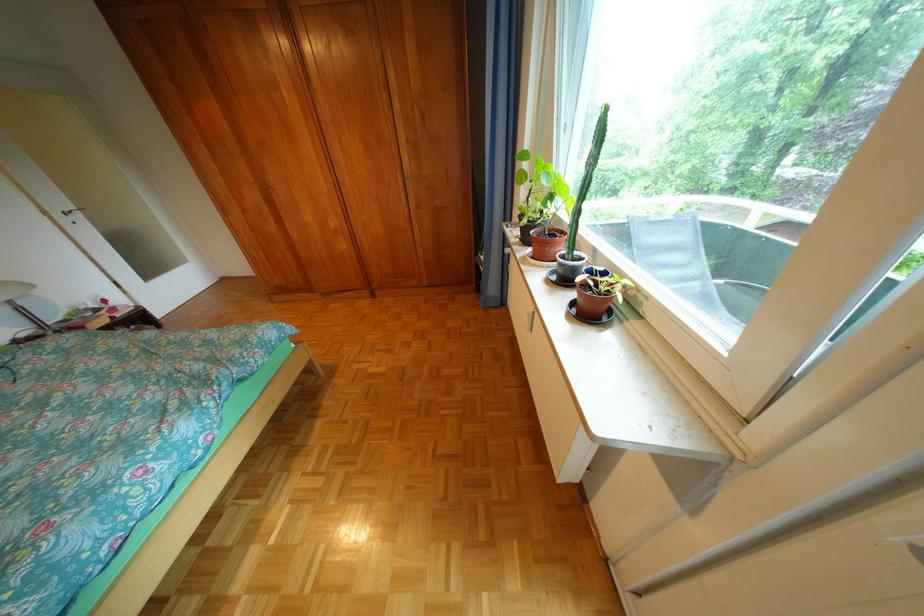
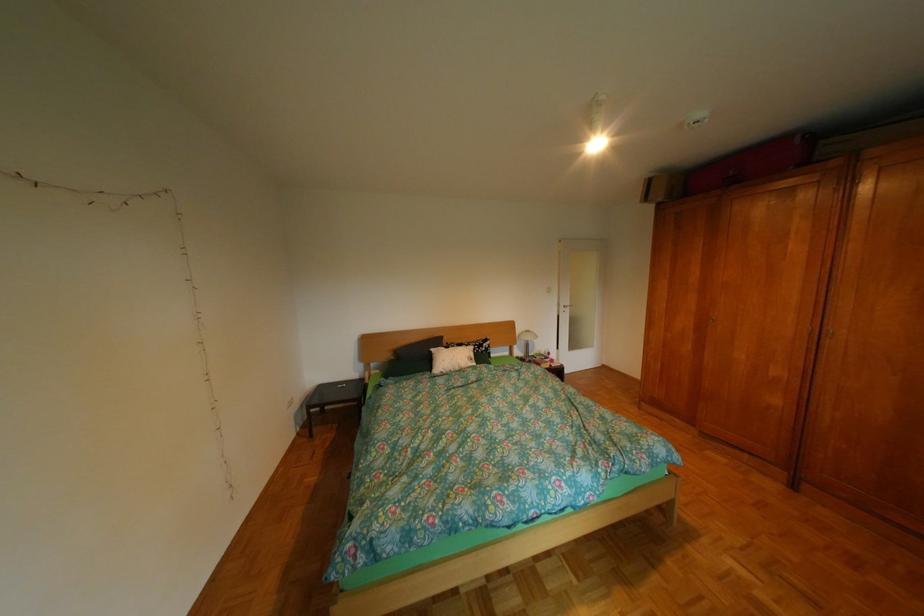
Question: The camera is either moving clockwise (left) or counter-clockwise (right) around the object. The first image is from the beginning of the video and the second image is from the end. Is the camera moving left or right when shooting the video?

Choices:
 (A) Left
 (B) Right

Answer: (B)